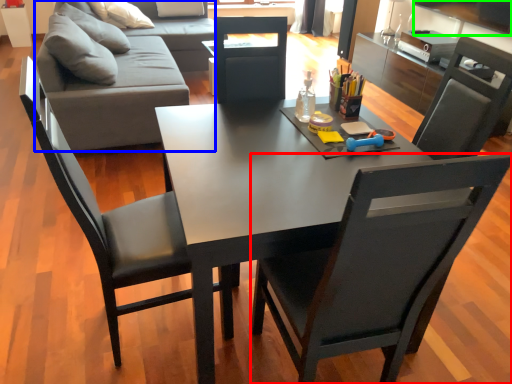
Question: Which is nearer to the chair (highlighted by a red box)? studio couch (highlighted by a blue box) or television (highlighted by a green box).

Choices:
 (A) studio couch
 (B) television

Answer: (A)